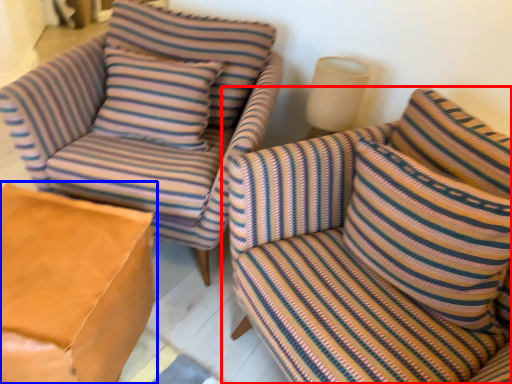
Question: Which point is further to the camera, studio couch (highlighted by a red box) or table (highlighted by a blue box)?

Choices:
 (A) studio couch
 (B) table

Answer: (B)